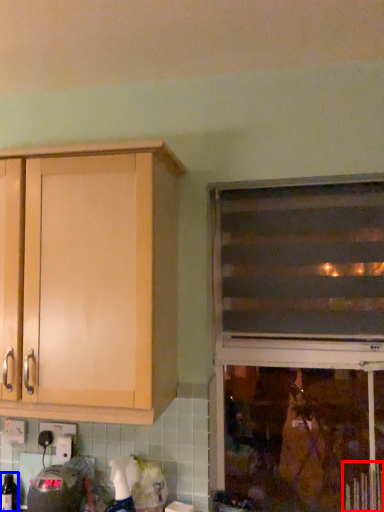
Question: Which point is closer to the camera, radiator (highlighted by a red box) or bottle (highlighted by a blue box)?

Choices:
 (A) radiator
 (B) bottle

Answer: (A)